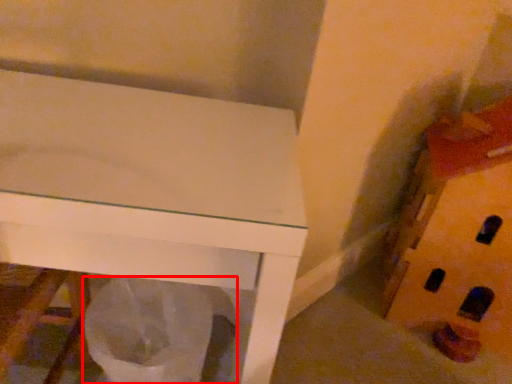
Question: In this image, where is garbage (annotated by the red box) located relative to toy?

Choices:
 (A) left
 (B) right

Answer: (A)